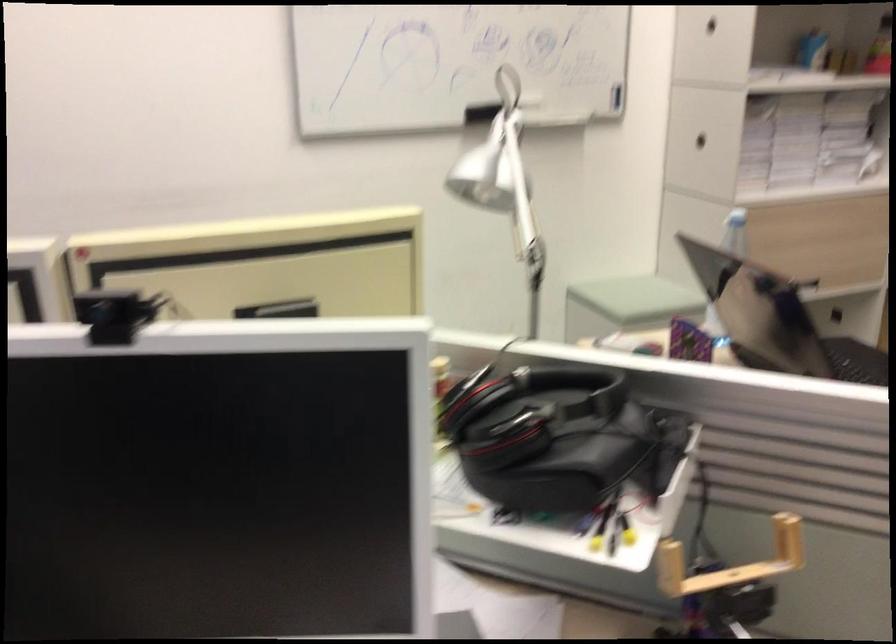
Find the location of a particular element. The height and width of the screenshot is (644, 896). wooden U-shaped handle is located at coordinates [x=730, y=562].